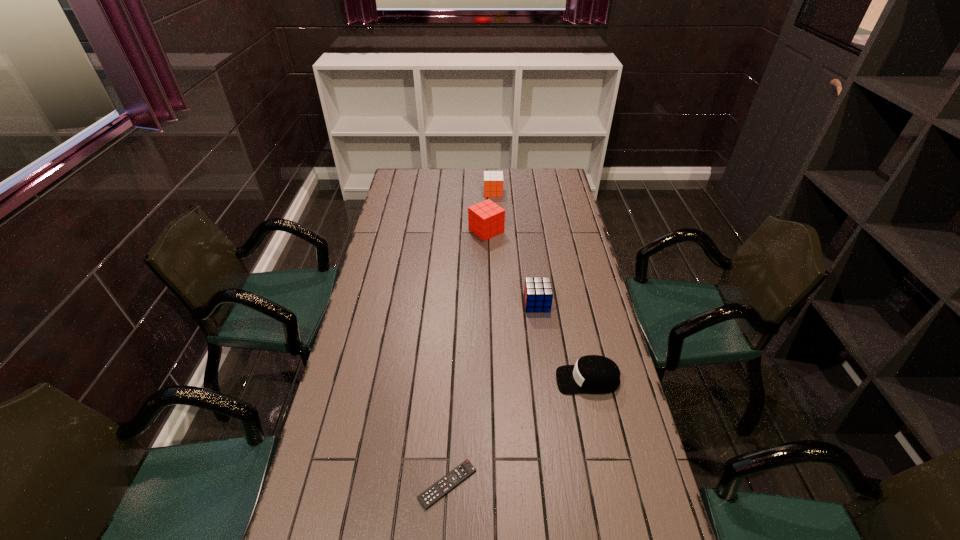
Select which object is the third closest to the farthest object. Please provide its 2D coordinates. Your answer should be formatted as a tuple, i.e. [(x, y)], where the tuple contains the x and y coordinates of a point satisfying the conditions above.

[(592, 374)]

Locate which cube ranks in proximity to the nearest object. Please provide its 2D coordinates. Your answer should be formatted as a tuple, i.e. [(x, y)], where the tuple contains the x and y coordinates of a point satisfying the conditions above.

[(538, 294)]

Find the location of `cube that is the second closest one to the nearest object`. cube that is the second closest one to the nearest object is located at coordinates (486, 219).

The height and width of the screenshot is (540, 960). I want to click on vacant space that satisfies the following two spatial constraints: 1. on the front-facing side of the fourth farthest object; 2. on the front side of the shortest object, so click(x=610, y=484).

Locate an element on the screen. free spot that satisfies the following two spatial constraints: 1. on the front side of the nearest cube; 2. on the left side of the second nearest cube is located at coordinates pos(488,304).